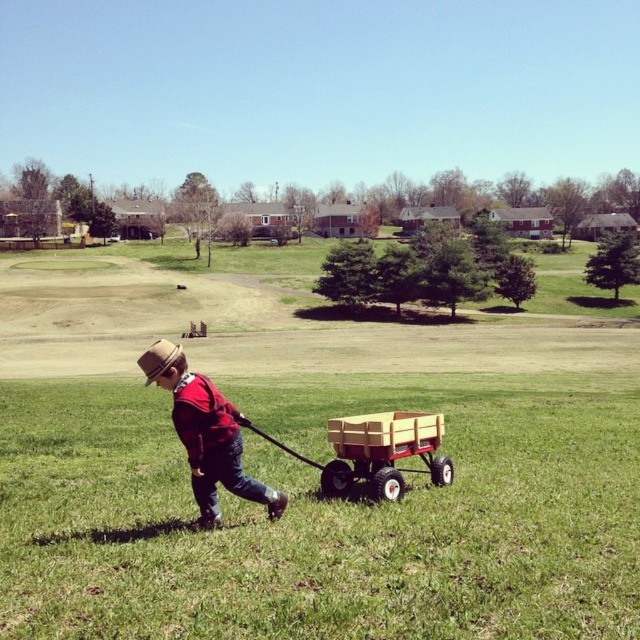
Is wooden wagon at center above brown straw hat at center?

Incorrect, wooden wagon at center is not positioned above brown straw hat at center.

Does point (333, 442) lie behind point (140, 365)?

Yes, point (333, 442) is farther from viewer.

The image size is (640, 640). Find the location of `wooden wagon at center`. wooden wagon at center is located at coordinates (376, 451).

Does grassy turf golf course at center lie behind wooden wagon at center?

No, it is not.

This screenshot has width=640, height=640. I want to click on grassy turf golf course at center, so click(307, 468).

Is matte brown hat at center behind wooden wagon at center?

No.

Does matte brown hat at center appear on the left side of wooden wagon at center?

Correct, you'll find matte brown hat at center to the left of wooden wagon at center.

Where is `matte brown hat at center`? matte brown hat at center is located at coordinates (205, 433).

This screenshot has width=640, height=640. I want to click on matte brown hat at center, so click(205, 433).